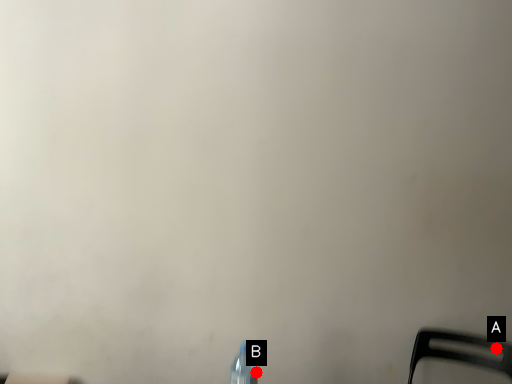
Question: Two points are circled on the image, labeled by A and B beside each circle. Which point is closer to the camera taking this photo?

Choices:
 (A) A is closer
 (B) B is closer

Answer: (B)